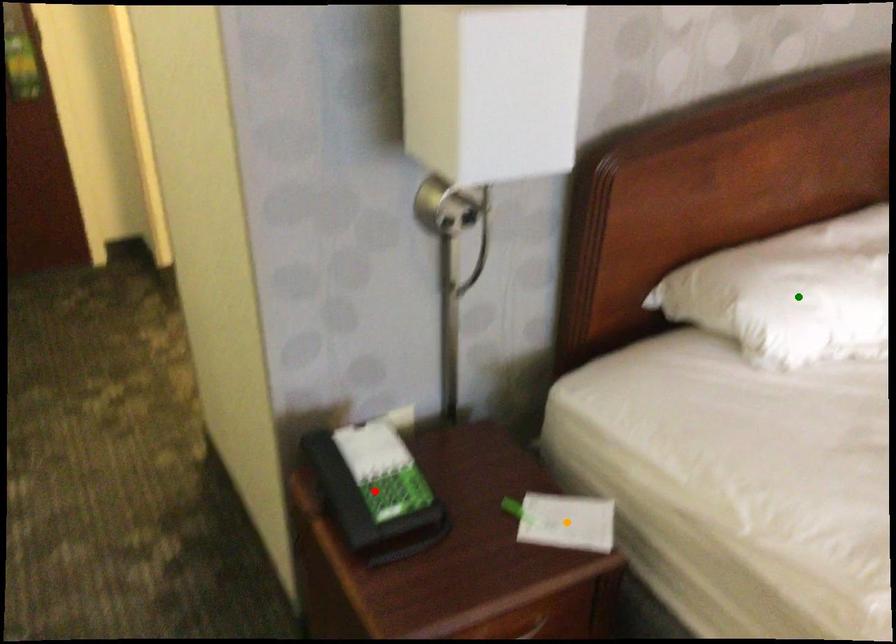
Order these from nearest to farthest:
red point
green point
orange point

red point
orange point
green point